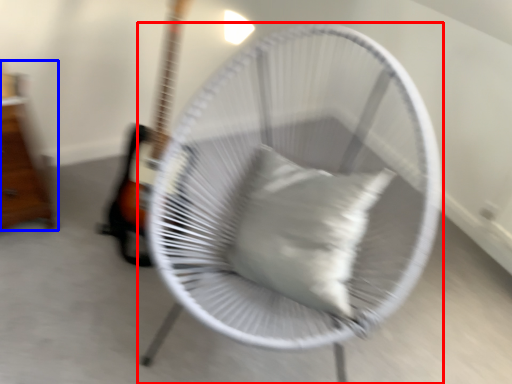
Question: Which of the following is the farthest to the observer, mechanical fan (highlighted by a red box) or furniture (highlighted by a blue box)?

Choices:
 (A) mechanical fan
 (B) furniture

Answer: (B)